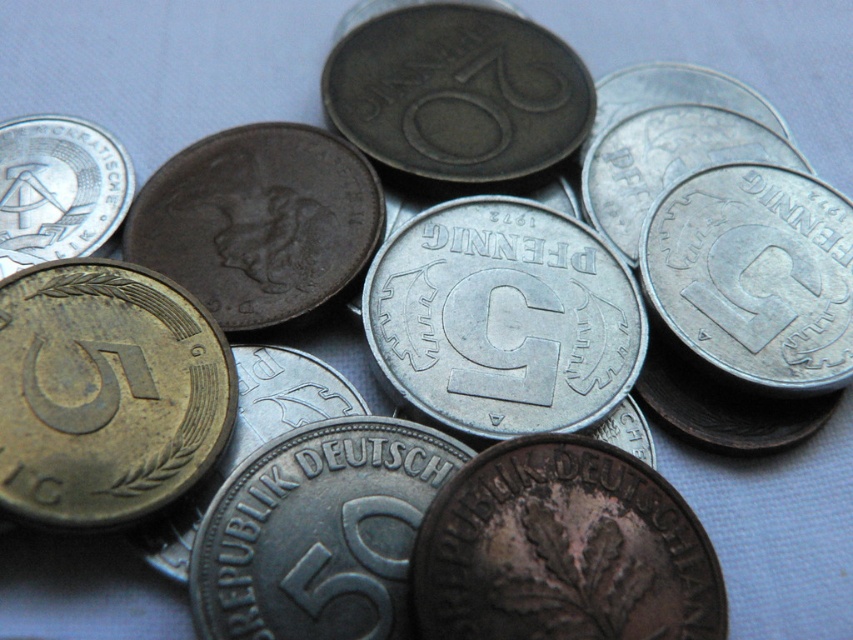
You are looking at a collection of coins on a table. You see a silver metallic coin at center and a silver metallic coin at upper left. Which coin is located more to the right?

The silver metallic coin at center is more to the right than the silver metallic coin at upper left.